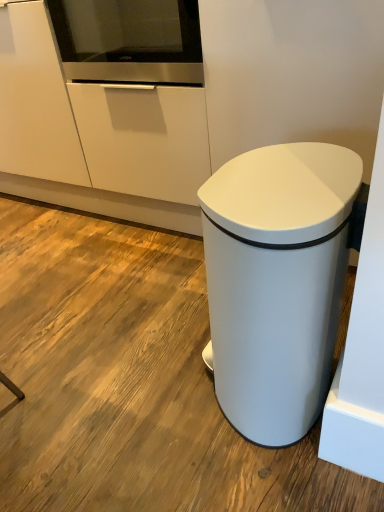
Find the location of `white matte waste container at lower right`. white matte waste container at lower right is located at coordinates (277, 282).

This screenshot has height=512, width=384. What do you see at coordinates (277, 282) in the screenshot?
I see `white matte waste container at lower right` at bounding box center [277, 282].

The image size is (384, 512). I want to click on stainless steel oven at upper center, so click(129, 40).

Image resolution: width=384 pixels, height=512 pixels. What do you see at coordinates (129, 40) in the screenshot? I see `stainless steel oven at upper center` at bounding box center [129, 40].

You are a GUI agent. You are given a task and a screenshot of the screen. Output one action in this format:
    pyautogui.click(x=<x>, y=<y>)
    Task: Click on the white matte waste container at lower right
    The height and width of the screenshot is (512, 384).
    Given the screenshot: What is the action you would take?
    pyautogui.click(x=277, y=282)

Is stainless steel oven at upper center to the left of white matte waste container at lower right from the viewer's perspective?

Indeed, stainless steel oven at upper center is positioned on the left side of white matte waste container at lower right.

Between stainless steel oven at upper center and white matte waste container at lower right, which one is positioned in front?

white matte waste container at lower right.

Between point (112, 5) and point (271, 151), which one is positioned behind?

The point (112, 5) is behind.

From the image's perspective, is stainless steel oven at upper center above or below white matte waste container at lower right?

Clearly, from the image's perspective, stainless steel oven at upper center is above white matte waste container at lower right.

From a real-world perspective, between stainless steel oven at upper center and white matte waste container at lower right, who is vertically higher?

stainless steel oven at upper center.

Which of these two, stainless steel oven at upper center or white matte waste container at lower right, is wider?

stainless steel oven at upper center is wider.

Is stainless steel oven at upper center taller than white matte waste container at lower right?

No.

In terms of size, does stainless steel oven at upper center appear bigger or smaller than white matte waste container at lower right?

In the image, stainless steel oven at upper center appears to be smaller than white matte waste container at lower right.

Do you think stainless steel oven at upper center is within white matte waste container at lower right, or outside of it?

stainless steel oven at upper center is located beyond the bounds of white matte waste container at lower right.

Is stainless steel oven at upper center directly adjacent to white matte waste container at lower right?

No, stainless steel oven at upper center is not making contact with white matte waste container at lower right.

Is stainless steel oven at upper center facing away from white matte waste container at lower right?

stainless steel oven at upper center does not have its back to white matte waste container at lower right.

How many degrees apart are the facing directions of stainless steel oven at upper center and white matte waste container at lower right?

stainless steel oven at upper center and white matte waste container at lower right are facing 90.2 degrees away from each other.

Locate an element on the screen. The height and width of the screenshot is (512, 384). home appliance behind the white matte waste container at lower right is located at coordinates (129, 40).

Based on their positions, is white matte waste container at lower right located to the left or right of stainless steel oven at upper center?

Based on their positions, white matte waste container at lower right is located to the right of stainless steel oven at upper center.

Which object is closer to the camera taking this photo, white matte waste container at lower right or stainless steel oven at upper center?

Positioned in front is white matte waste container at lower right.

Which point is more forward, (270, 175) or (121, 3)?

The point (270, 175) is more forward.

From the image's perspective, between white matte waste container at lower right and stainless steel oven at upper center, which one is located above?

From the image's view, stainless steel oven at upper center is above.

From a real-world perspective, is white matte waste container at lower right located beneath stainless steel oven at upper center?

Correct, in the physical world, white matte waste container at lower right is lower than stainless steel oven at upper center.

Considering the sizes of objects white matte waste container at lower right and stainless steel oven at upper center in the image provided, who is wider, white matte waste container at lower right or stainless steel oven at upper center?

stainless steel oven at upper center.

Who is taller, white matte waste container at lower right or stainless steel oven at upper center?

With more height is white matte waste container at lower right.

Looking at the image, does white matte waste container at lower right seem bigger or smaller compared to stainless steel oven at upper center?

Clearly, white matte waste container at lower right is larger in size than stainless steel oven at upper center.

Is stainless steel oven at upper center surrounded by white matte waste container at lower right?

That's incorrect, stainless steel oven at upper center is not inside white matte waste container at lower right.

Is white matte waste container at lower right touching stainless steel oven at upper center?

white matte waste container at lower right and stainless steel oven at upper center are not in contact.

Could you tell me if white matte waste container at lower right is turned towards stainless steel oven at upper center?

No, white matte waste container at lower right is not aimed at stainless steel oven at upper center.

Can you tell me how much white matte waste container at lower right and stainless steel oven at upper center differ in facing direction?

They differ by 90.2 degrees in their facing directions.

Identify the location of home appliance lying behind the white matte waste container at lower right. The height and width of the screenshot is (512, 384). (129, 40).

The height and width of the screenshot is (512, 384). I want to click on waste container on the right of the stainless steel oven at upper center, so click(x=277, y=282).

Image resolution: width=384 pixels, height=512 pixels. In the image, there is a stainless steel oven at upper center. What are the coordinates of `waste container below it (from the image's perspective)` in the screenshot? It's located at (277, 282).